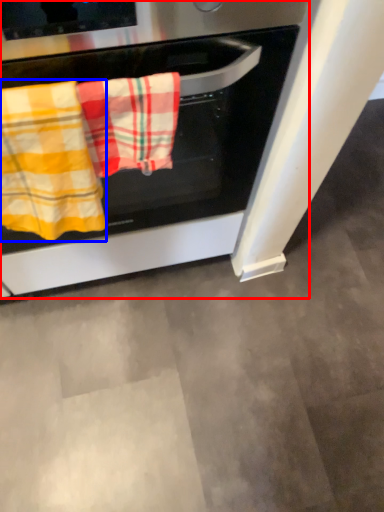
Question: Which point is further to the camera, oven (highlighted by a red box) or beach towel (highlighted by a blue box)?

Choices:
 (A) oven
 (B) beach towel

Answer: (B)